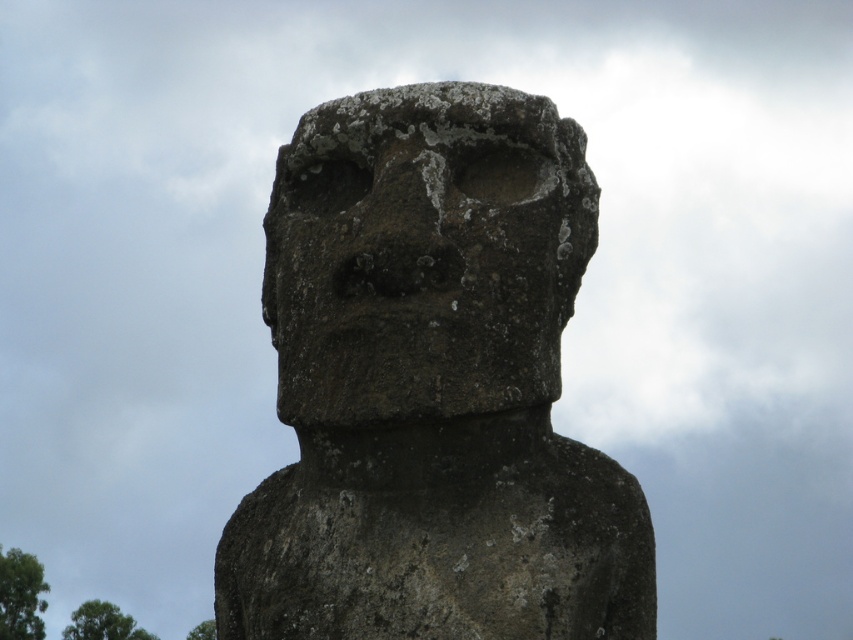
Question: Can you confirm if rough stone statue at center is smaller than rough stone face at center?

Choices:
 (A) yes
 (B) no

Answer: (B)

Question: Is rough stone statue at center closer to camera compared to rough stone face at center?

Choices:
 (A) no
 (B) yes

Answer: (A)

Question: Which of the following is the closest to the observer?

Choices:
 (A) rough stone statue at center
 (B) rough stone face at center

Answer: (B)

Question: Does rough stone statue at center have a smaller size compared to rough stone face at center?

Choices:
 (A) yes
 (B) no

Answer: (B)

Question: Which point is farther to the camera?

Choices:
 (A) (474, 397)
 (B) (486, 253)

Answer: (B)

Question: Which object is farther from the camera taking this photo?

Choices:
 (A) rough stone face at center
 (B) rough stone statue at center

Answer: (B)